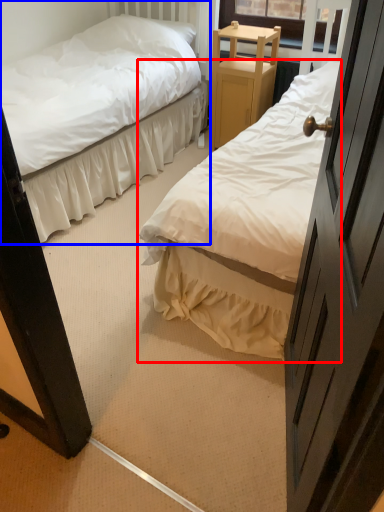
Question: Which object appears closest to the camera in this image, bed (highlighted by a red box) or bed (highlighted by a blue box)?

Choices:
 (A) bed
 (B) bed

Answer: (A)